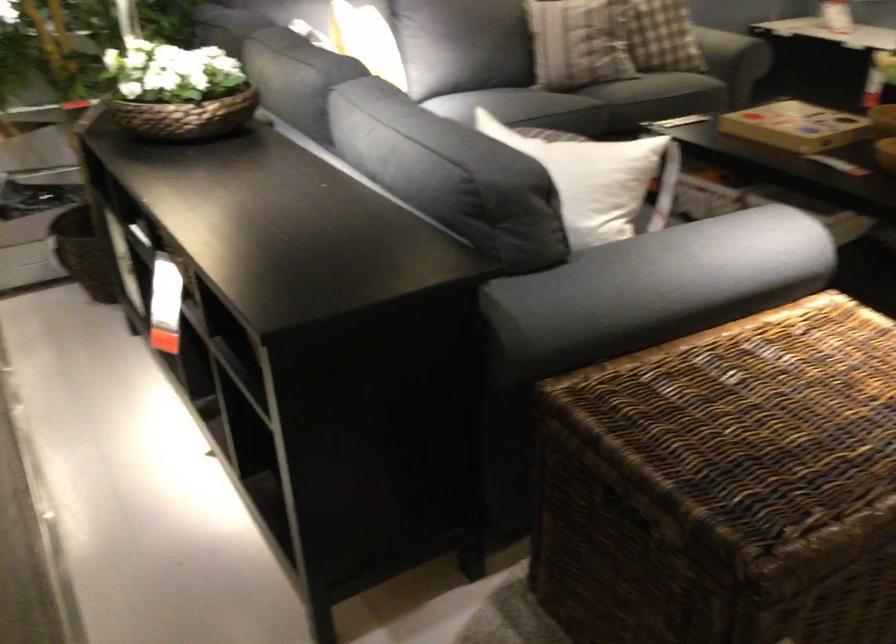
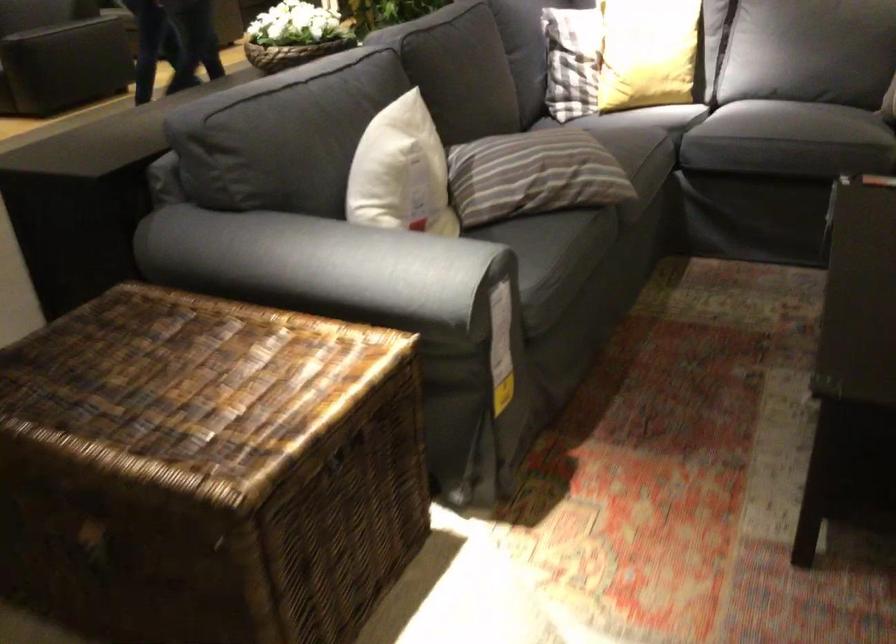
Where in the second image is the point corresponding to the point at 607,161 from the first image?

(401, 172)